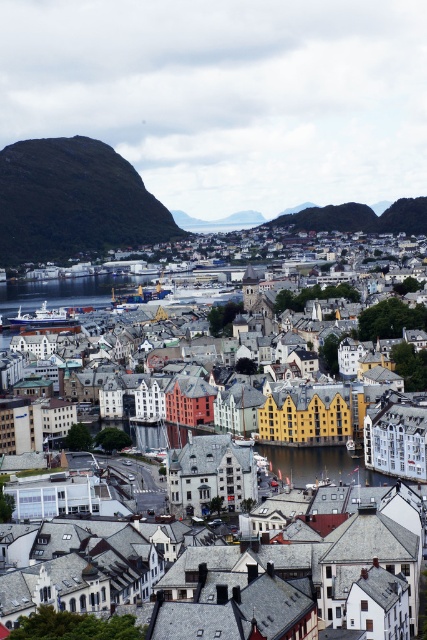
Question: Is dark gray rocky mountain at left to the right of transparent water at center from the viewer's perspective?

Choices:
 (A) yes
 (B) no

Answer: (B)

Question: Which object is positioned closest to the yellow matte building at center?

Choices:
 (A) dark gray rocky mountain at left
 (B) transparent water at center

Answer: (B)

Question: Does dark gray rocky mountain at left have a greater width compared to transparent water at center?

Choices:
 (A) yes
 (B) no

Answer: (A)

Question: Can you confirm if yellow matte building at center is thinner than dark gray rocky mountain at left?

Choices:
 (A) no
 (B) yes

Answer: (A)

Question: Which of these objects is positioned farthest from the transparent water at center?

Choices:
 (A) yellow matte building at center
 (B) dark gray rocky mountain at left

Answer: (B)

Question: Which is farther from the yellow matte building at center?

Choices:
 (A) dark gray rocky mountain at left
 (B) transparent water at center

Answer: (A)